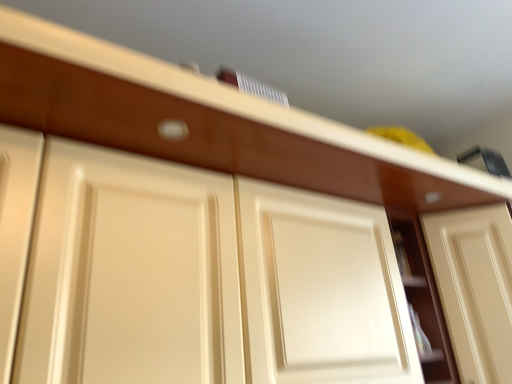
Question: Based on their positions, is matte cream door at center, acting as the 1th door starting from the right, located to the left or right of matte cream cabinet at center?

Choices:
 (A) right
 (B) left

Answer: (A)

Question: Do you think matte cream door at center, which is the second door from left to right, is within matte cream cabinet at center, or outside of it?

Choices:
 (A) outside
 (B) inside

Answer: (A)

Question: Estimate the real-world distances between objects in this image. Which object is farther from the matte cream cabinet door at center, marked as the first door in a left-to-right arrangement?

Choices:
 (A) matte cream drawer at center
 (B) matte cream cabinet at center
 (C) matte white door handle at upper center
 (D) matte cream door at center, which is the second door from left to right

Answer: (D)

Question: Which object is positioned closest to the matte white door handle at upper center?

Choices:
 (A) matte cream drawer at center
 (B) matte cream cabinet at center
 (C) matte cream cabinet door at center, which ranks as the second door in right-to-left order
 (D) matte cream door at center, which is the second door from left to right

Answer: (A)